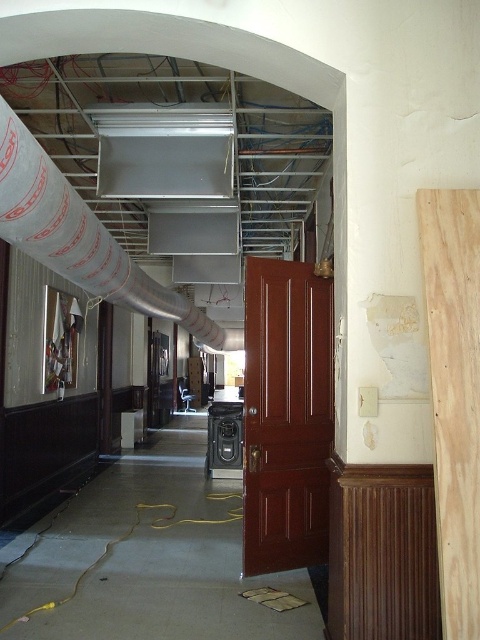
You are standing at the entrance of the hallway and want to move towards the end of the hallway. Which point, point (x=256, y=547) or point (x=120, y=304), will you encounter first?

Point (x=256, y=547) is closer to the viewer than point (x=120, y=304), so you will encounter point (x=256, y=547) first.

In the scene shown: You are standing in the hallway and want to locate the mahogany wood door at center. Based on the coordinates provided, can you determine its exact position?

The mahogany wood door at center is located at coordinates point (286, 416).

From the picture: You are standing in the hallway and want to place a small potted plant exactly at the point marked by the coordinates point [454,394]. Is this location suitable for placing the plant?

The point [454,394] is marked as natural wood plank at right, which is part of the construction materials leaning against the wall. Since this area is likely an unstable or temporary surface, placing a potted plant there may not be safe or advisable.